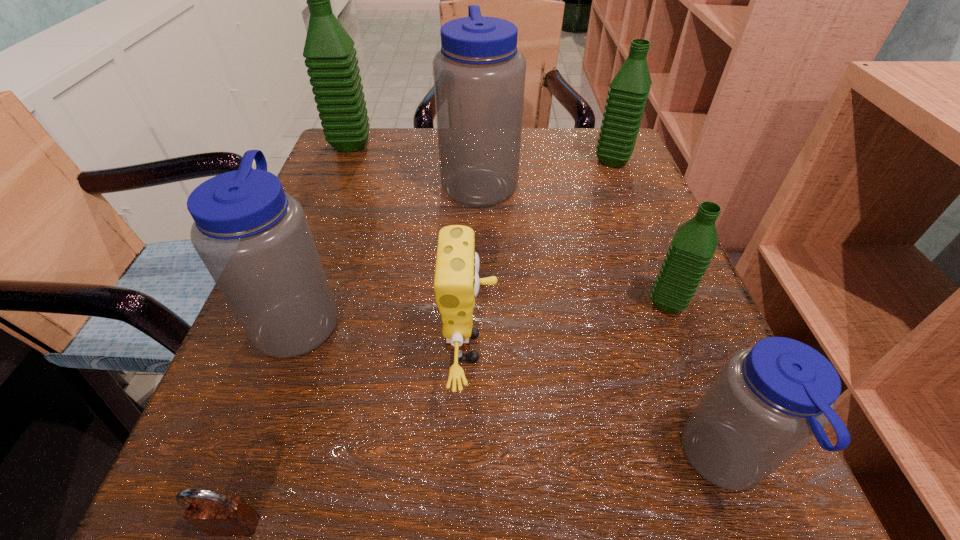
Locate an element on the screen. The height and width of the screenshot is (540, 960). vacant area that lies between the nearest water bottle and the sponge is located at coordinates (597, 405).

Identify which object is located as the sixth nearest to the sponge. Please provide its 2D coordinates. Your answer should be formatted as a tuple, i.e. [(x, y)], where the tuple contains the x and y coordinates of a point satisfying the conditions above.

[(628, 93)]

Select which object appears as the sixth closest to the biggest green water bottle. Please provide its 2D coordinates. Your answer should be formatted as a tuple, i.e. [(x, y)], where the tuple contains the x and y coordinates of a point satisfying the conditions above.

[(216, 514)]

Find the location of `the third closest water bottle to the brown padlock`. the third closest water bottle to the brown padlock is located at coordinates (479, 74).

Select which water bottle is the closest to the smallest green water bottle. Please provide its 2D coordinates. Your answer should be formatted as a tuple, i.e. [(x, y)], where the tuple contains the x and y coordinates of a point satisfying the conditions above.

[(770, 400)]

Point out which green water bottle is positioned as the third nearest to the fourth water bottle from right to left. Please provide its 2D coordinates. Your answer should be formatted as a tuple, i.e. [(x, y)], where the tuple contains the x and y coordinates of a point satisfying the conditions above.

[(693, 246)]

Select which green water bottle appears as the closest to the nearest water bottle. Please provide its 2D coordinates. Your answer should be formatted as a tuple, i.e. [(x, y)], where the tuple contains the x and y coordinates of a point satisfying the conditions above.

[(693, 246)]

Locate which blue water bottle ranks third in proximity to the second smallest green water bottle. Please provide its 2D coordinates. Your answer should be formatted as a tuple, i.e. [(x, y)], where the tuple contains the x and y coordinates of a point satisfying the conditions above.

[(254, 239)]

At what (x,y) coordinates should I click in order to perform the action: click on blue water bottle that is the second closest to the nearest blue water bottle. Please return your answer as a coordinate pair (x, y). Image resolution: width=960 pixels, height=540 pixels. Looking at the image, I should click on (254, 239).

Where is `vacant space that satisfies the following two spatial constraints: 1. on the face of the sponge; 2. on the front-facing side of the padlock`? Image resolution: width=960 pixels, height=540 pixels. vacant space that satisfies the following two spatial constraints: 1. on the face of the sponge; 2. on the front-facing side of the padlock is located at coordinates (467, 525).